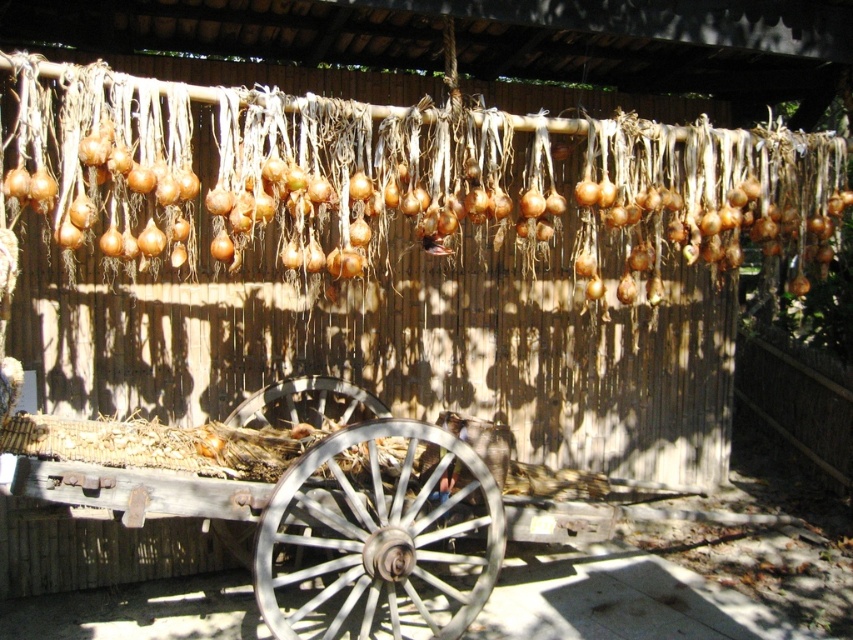
Describe the element at coordinates (379, 536) in the screenshot. The height and width of the screenshot is (640, 853). I see `silver metallic wagon wheel at center` at that location.

Is silver metallic wagon wheel at center to the left of wooden wagon wheel at center from the viewer's perspective?

In fact, silver metallic wagon wheel at center is to the right of wooden wagon wheel at center.

Find the location of a particular element. The width and height of the screenshot is (853, 640). silver metallic wagon wheel at center is located at coordinates (379, 536).